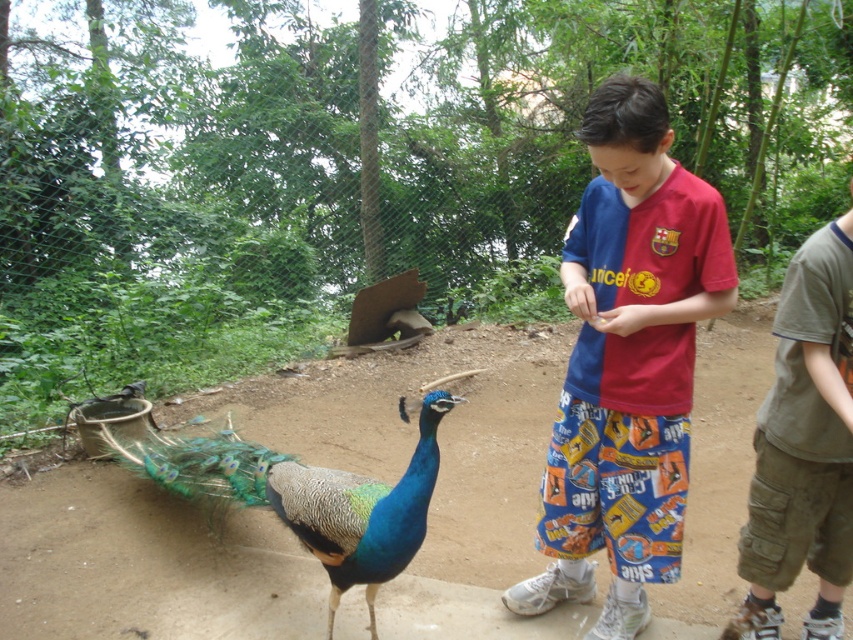
Question: Does blue and red jersey at center come in front of khaki cotton shorts at right?

Choices:
 (A) no
 (B) yes

Answer: (B)

Question: Does blue and red jersey at center have a greater width compared to blue iridescent feathers at center?

Choices:
 (A) no
 (B) yes

Answer: (A)

Question: Which point is farther to the camera?

Choices:
 (A) (337, 515)
 (B) (604, 454)

Answer: (B)

Question: Which object is farther from the camera taking this photo?

Choices:
 (A) khaki cotton shorts at right
 (B) blue and red jersey at center

Answer: (A)

Question: Is blue and red jersey at center thinner than khaki cotton shorts at right?

Choices:
 (A) no
 (B) yes

Answer: (A)

Question: Which point appears closest to the camera in this image?

Choices:
 (A) (654, 417)
 (B) (222, 458)

Answer: (A)